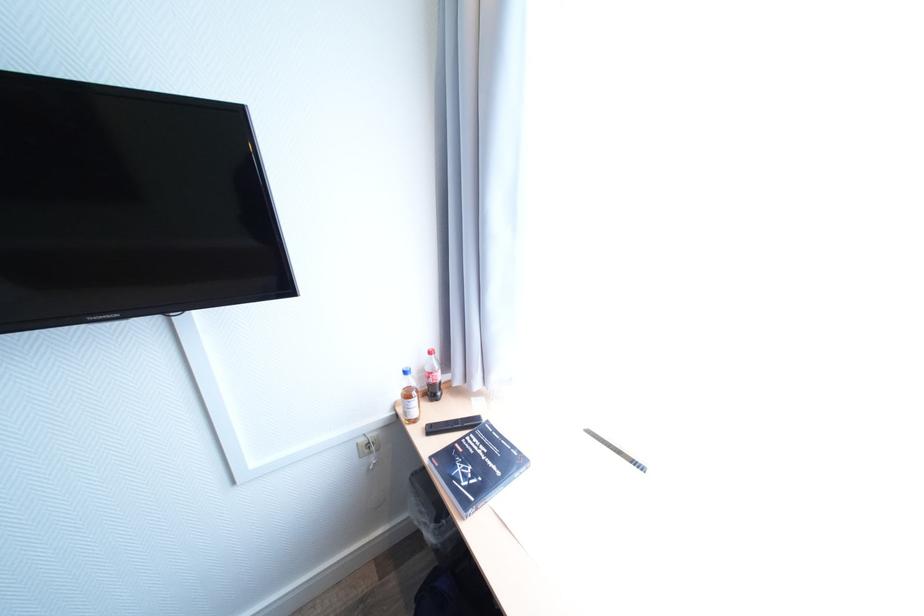
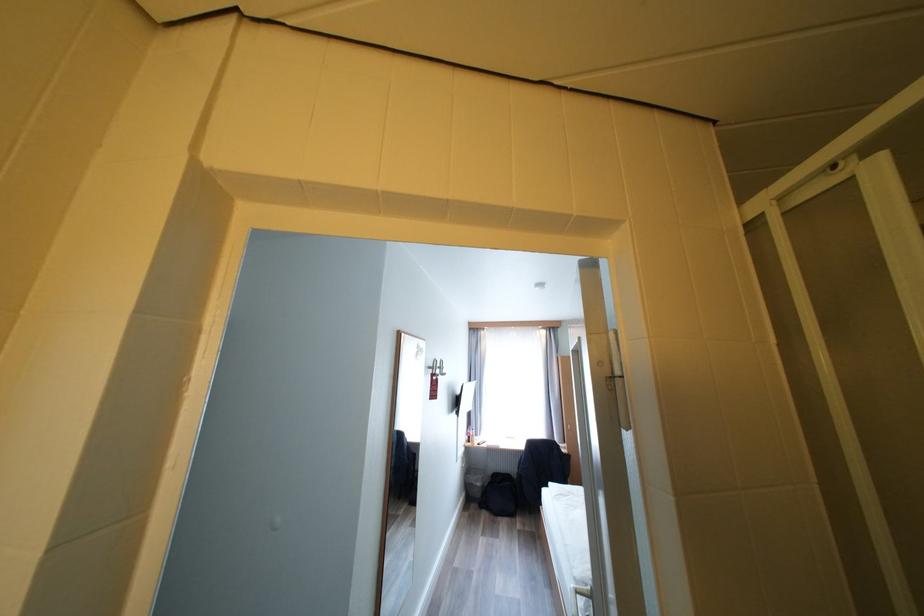
Question: I am providing you with two images of the same scene from different viewpoints. Which of the following objects are not visible in image2?

Choices:
 (A) white wall button
 (B) red bottle cap
 (C) red door tag
 (D) white oven dial

Answer: (B)